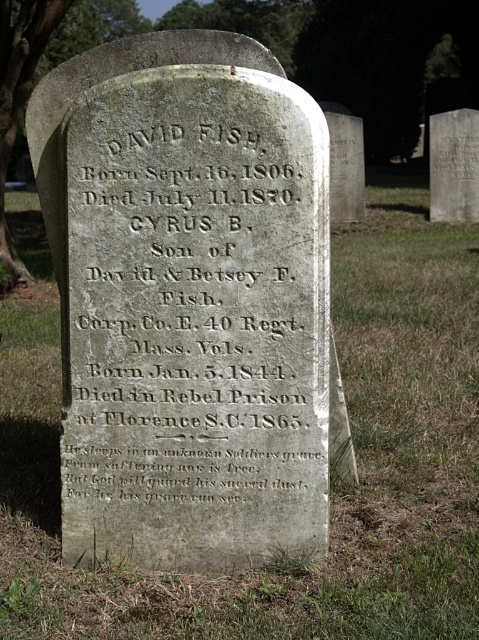
You are a historian examining the cemetery. You notice two gray stones. The first is the gray stone inscription at center, and the second is the smooth gray stone at upper right. Which of these two stones is larger in size?

The smooth gray stone at upper right is larger in size compared to the gray stone inscription at center.

You are standing in front of a gravestone in a cemetery. You see the gray stone inscription at center and the smooth gray stone at upper right. Which object is located to the right of the other?

The smooth gray stone at upper right is located to the right of the gray stone inscription at center.